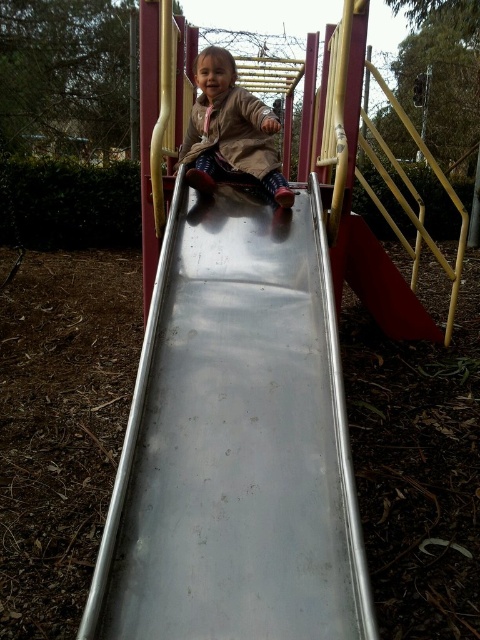
Question: Which of the following is the farthest from the observer?

Choices:
 (A) (327, 262)
 (B) (282, 193)

Answer: (B)

Question: Among these objects, which one is nearest to the camera?

Choices:
 (A) matte brown coat at center
 (B) metallic smooth slide at center

Answer: (B)

Question: Can you confirm if metallic smooth slide at center is wider than matte brown coat at center?

Choices:
 (A) yes
 (B) no

Answer: (A)

Question: Is metallic smooth slide at center above matte brown coat at center?

Choices:
 (A) yes
 (B) no

Answer: (B)

Question: Can you confirm if metallic smooth slide at center is positioned to the left of matte brown coat at center?

Choices:
 (A) yes
 (B) no

Answer: (B)